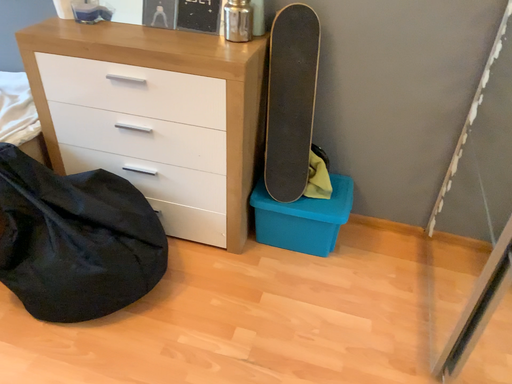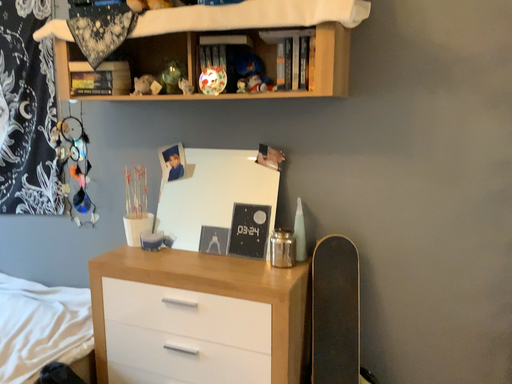
Question: Which way did the camera rotate in the video?

Choices:
 (A) rotated downward
 (B) rotated upward

Answer: (B)